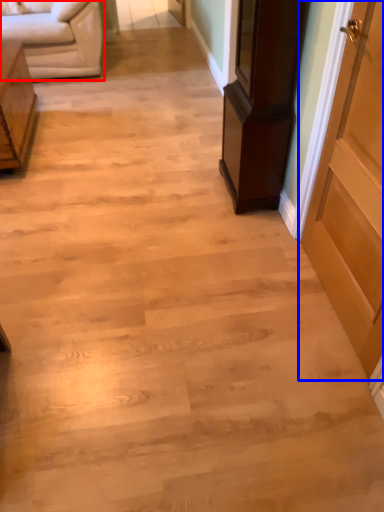
Question: Which point is closer to the camera, studio couch (highlighted by a red box) or door (highlighted by a blue box)?

Choices:
 (A) studio couch
 (B) door

Answer: (B)